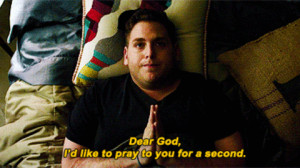
The height and width of the screenshot is (168, 300). In order to click on pillows in this screenshot , I will do `click(278, 70)`, `click(187, 19)`.